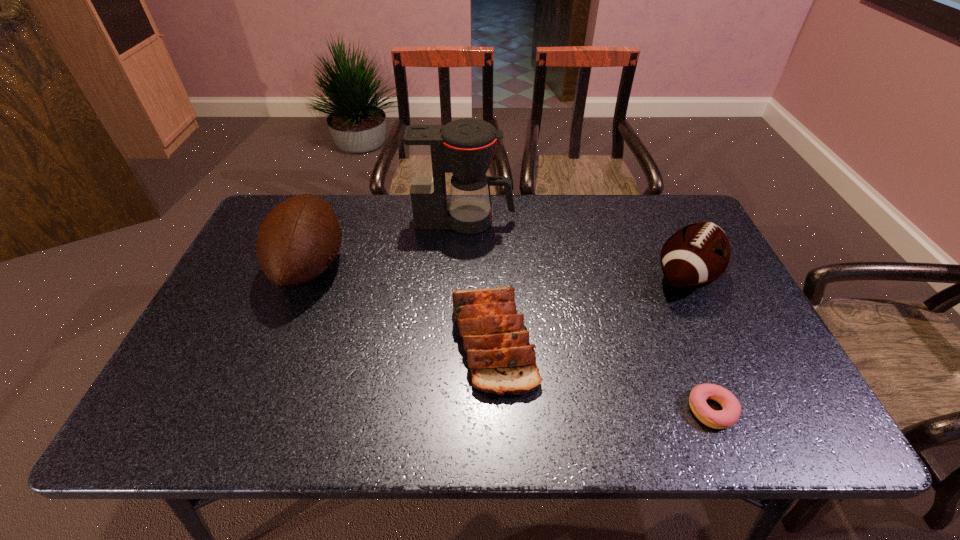
Where is `the tallest object`? The height and width of the screenshot is (540, 960). the tallest object is located at coordinates (465, 147).

Locate an element on the screen. the taller football (American) is located at coordinates (300, 237).

Find the location of a particular element. the left football (American) is located at coordinates (300, 237).

Identify the location of the shorter football (American). The height and width of the screenshot is (540, 960). [x=696, y=255].

In order to click on the third shortest object in this screenshot , I will do `click(696, 255)`.

Where is `bread`? The height and width of the screenshot is (540, 960). bread is located at coordinates pos(502,361).

This screenshot has height=540, width=960. Find the location of `the shortest object`. the shortest object is located at coordinates (731, 411).

This screenshot has height=540, width=960. I want to click on vacant space located 0.360m pour from the carafe of the tallest object, so click(x=627, y=221).

The width and height of the screenshot is (960, 540). In order to click on vacant space located 0.160m on the laces of the leftmost object in this screenshot , I will do [x=401, y=266].

The height and width of the screenshot is (540, 960). In order to click on free region located 0.200m on the back of the shorter football (American) in this screenshot , I will do `click(655, 211)`.